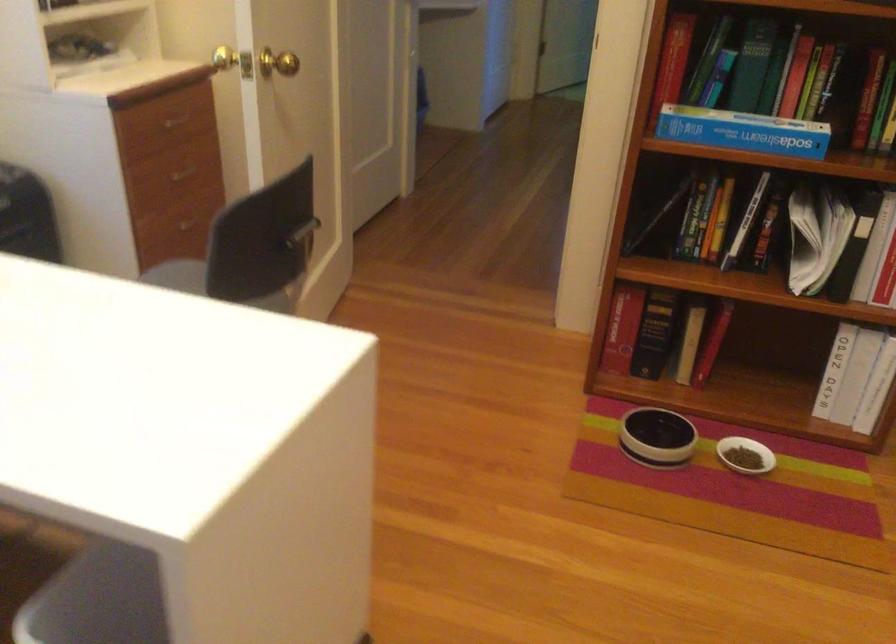
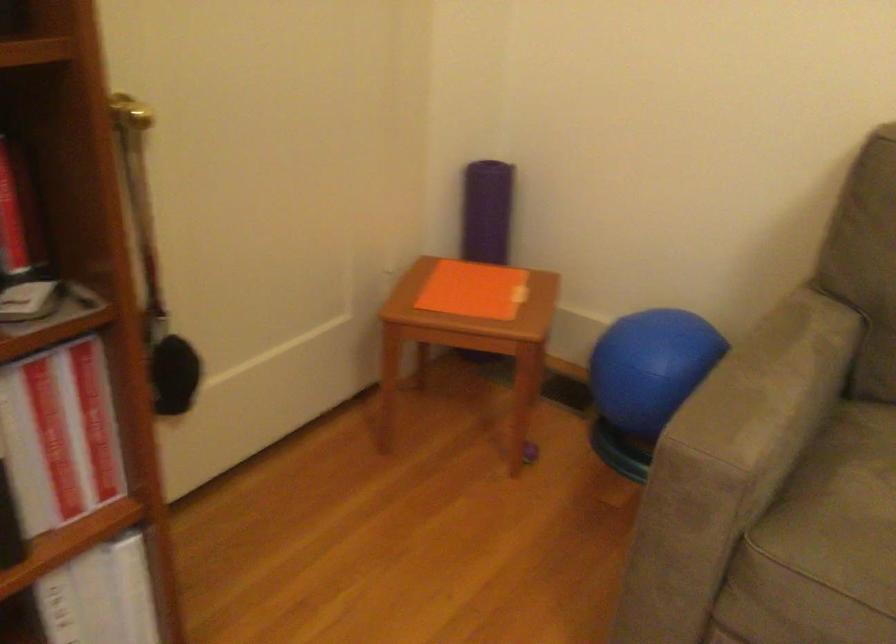
How did the camera likely rotate?

The rotation direction of the camera is right-down.